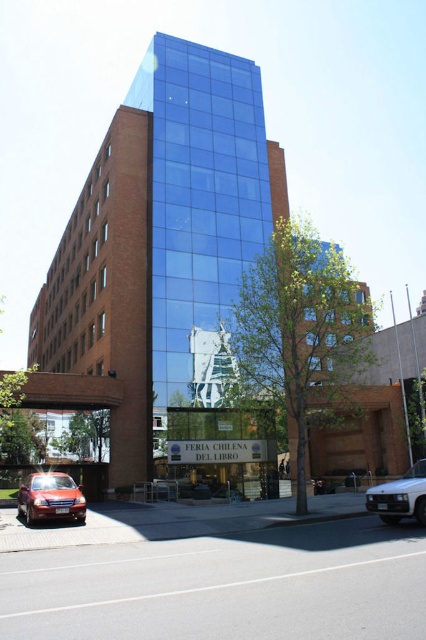
You are standing on the sidewalk in front of the building and see the shiny red sedan at lower left. If you want to walk to the sedan, how many steps would you need to take if each step is about 2.5 feet long?

The distance between you and the shiny red sedan at lower left is 51.62 feet. Dividing this by the step length of 2.5 feet gives approximately 20.65 steps. Since you can only take whole steps, you would need to take about 21 steps to reach the shiny red sedan at lower left.